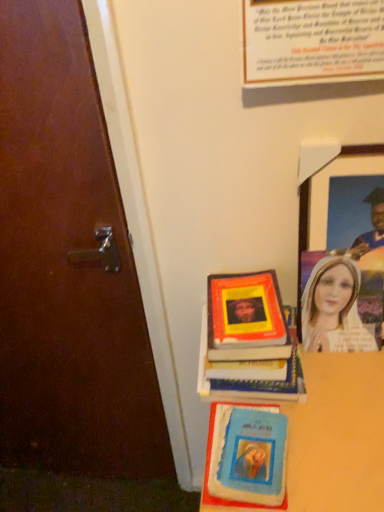
What is the approximate height of matte paper poster at upper center?

matte paper poster at upper center is 46.41 centimeters tall.

The width and height of the screenshot is (384, 512). What are the coordinates of `hardcover book at center` in the screenshot? It's located at (248, 340).

The width and height of the screenshot is (384, 512). I want to click on blue matte book at lower center, so click(210, 463).

This screenshot has width=384, height=512. Identify the location of wooden picture frame at upper right. click(343, 253).

Who is shorter, hardcover book at center or smooth wooden table at lower right?

With less height is hardcover book at center.

Does hardcover book at center turn towards smooth wooden table at lower right?

No, hardcover book at center does not turn towards smooth wooden table at lower right.

Is point (281, 382) positioned behind point (326, 428)?

Yes, point (281, 382) is farther from viewer.

Consider the image. From the image's perspective, does hardcover book at center appear lower than smooth wooden table at lower right?

No.

Looking at the image, does wooden picture frame at upper right seem bigger or smaller compared to smooth wooden table at lower right?

wooden picture frame at upper right is smaller than smooth wooden table at lower right.

Who is shorter, wooden picture frame at upper right or smooth wooden table at lower right?

wooden picture frame at upper right.

Is wooden picture frame at upper right completely or partially outside of smooth wooden table at lower right?

wooden picture frame at upper right is positioned outside smooth wooden table at lower right.

How distant is wooden picture frame at upper right from smooth wooden table at lower right?

wooden picture frame at upper right and smooth wooden table at lower right are 7.05 inches apart from each other.

Based on the photo, considering the relative sizes of blue matte book at lower center and smooth wooden table at lower right in the image provided, is blue matte book at lower center smaller than smooth wooden table at lower right?

Yes, blue matte book at lower center is smaller than smooth wooden table at lower right.

From the picture: Considering the relative positions of blue matte book at lower center and smooth wooden table at lower right in the image provided, is blue matte book at lower center to the left of smooth wooden table at lower right from the viewer's perspective?

Yes, blue matte book at lower center is to the left of smooth wooden table at lower right.

Are blue matte book at lower center and smooth wooden table at lower right located far from each other?

No, there isn't a large distance between blue matte book at lower center and smooth wooden table at lower right.

The image size is (384, 512). I want to click on table in front of the blue matte book at lower center, so click(338, 434).

Does matte paper poster at upper center turn towards blue matte book at lower center?

No, matte paper poster at upper center is not facing towards blue matte book at lower center.

Can you confirm if matte paper poster at upper center is wider than blue matte book at lower center?

No, matte paper poster at upper center is not wider than blue matte book at lower center.

Considering the sizes of matte paper poster at upper center and blue matte book at lower center in the image, is matte paper poster at upper center bigger or smaller than blue matte book at lower center?

matte paper poster at upper center is bigger than blue matte book at lower center.

Does matte paper poster at upper center have a lesser height compared to blue matte book at lower center?

No.

Is point (278, 405) more distant than point (355, 288)?

No, (278, 405) is in front of (355, 288).

From a real-world perspective, which object rests below the other?

blue matte book at lower center.

Is there a large distance between blue matte book at lower center and matte plastic portrait at right?

No, blue matte book at lower center is in close proximity to matte plastic portrait at right.

Looking at their sizes, would you say blue matte book at lower center is wider or thinner than matte plastic portrait at right?

Clearly, blue matte book at lower center has more width compared to matte plastic portrait at right.

Is wooden picture frame at upper right facing towards blue matte book at lower center?

No, wooden picture frame at upper right is not oriented towards blue matte book at lower center.

From a real-world perspective, relative to blue matte book at lower center, is wooden picture frame at upper right vertically above or below?

In terms of real-world spatial position, wooden picture frame at upper right is above blue matte book at lower center.

From the image's perspective, is wooden picture frame at upper right located above or below blue matte book at lower center?

wooden picture frame at upper right is situated higher than blue matte book at lower center in the image.

Is smooth wooden table at lower right positioned behind matte paper poster at upper center?

Yes, smooth wooden table at lower right is further from the camera.

Can you confirm if smooth wooden table at lower right is bigger than matte paper poster at upper center?

Indeed, smooth wooden table at lower right has a larger size compared to matte paper poster at upper center.

Are smooth wooden table at lower right and matte paper poster at upper center far apart?

No, there isn't a large distance between smooth wooden table at lower right and matte paper poster at upper center.

Where is `table located below the hardcover book at center (from the image's perspective)`? This screenshot has height=512, width=384. table located below the hardcover book at center (from the image's perspective) is located at coordinates (338, 434).

Find the location of a particular element. picture frame behind the smooth wooden table at lower right is located at coordinates (343, 253).

From the image, which object appears to be nearer to matte plastic portrait at right, matte paper poster at upper center or hardcover book at center?

Among the two, hardcover book at center is located nearer to matte plastic portrait at right.

Based on their spatial positions, is wooden picture frame at upper right or blue matte book at lower center further from smooth wooden table at lower right?

wooden picture frame at upper right lies further to smooth wooden table at lower right than the other object.

Looking at the image, which one is located closer to matte plastic portrait at right, smooth wooden table at lower right or wooden picture frame at upper right?

wooden picture frame at upper right.

Which object lies further to the anchor point matte paper poster at upper center, hardcover book at center or wooden picture frame at upper right?

hardcover book at center is further to matte paper poster at upper center.

Which object lies nearer to the anchor point wooden picture frame at upper right, matte plastic portrait at right or matte paper poster at upper center?

matte plastic portrait at right is closer to wooden picture frame at upper right.

Which object lies nearer to the anchor point blue matte book at lower center, matte paper poster at upper center or smooth wooden table at lower right?

The object closer to blue matte book at lower center is smooth wooden table at lower right.

Looking at the image, which one is located closer to matte paper poster at upper center, blue matte book at lower center or smooth wooden table at lower right?

smooth wooden table at lower right is closer to matte paper poster at upper center.

When comparing their distances from hardcover book at center, does wooden picture frame at upper right or blue matte book at lower center seem further?

Among the two, wooden picture frame at upper right is located further to hardcover book at center.

This screenshot has height=512, width=384. I want to click on book cover between matte paper poster at upper center and smooth wooden table at lower right in the up-down direction, so click(210, 463).

Where is `woman between matte paper poster at upper center and blue matte book at lower center in the up-down direction`? The height and width of the screenshot is (512, 384). woman between matte paper poster at upper center and blue matte book at lower center in the up-down direction is located at coordinates (335, 309).

Where is `woman between wooden picture frame at upper right and smooth wooden table at lower right in the up-down direction`? The width and height of the screenshot is (384, 512). woman between wooden picture frame at upper right and smooth wooden table at lower right in the up-down direction is located at coordinates (335, 309).

The width and height of the screenshot is (384, 512). What are the coordinates of `woman between matte paper poster at upper center and hardcover book at center vertically` in the screenshot? It's located at [x=335, y=309].